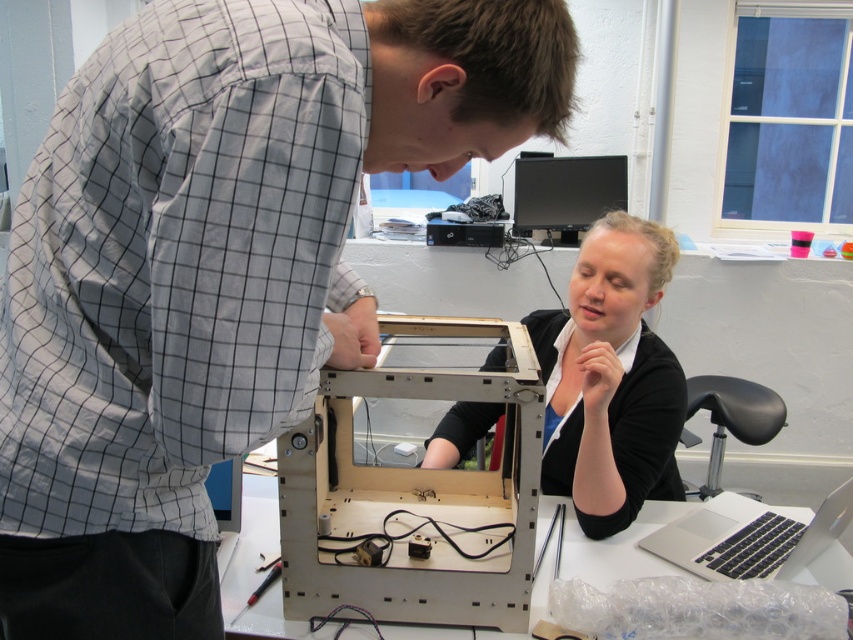
You are a technician who needs to place a new component on the largest available screen in the scene. Which object should you choose between the silver metallic laptop at lower right and the black glossy monitor at upper center?

The black glossy monitor at upper center is larger than the silver metallic laptop at lower right, so you should choose the black glossy monitor at upper center to place the new component.

You are an engineer who needs to transport both the metallic silver electronics at center and the silver metallic laptop at lower right in a box that can only accommodate items up to the size of the laptop. Can you fit both items into the box?

The metallic silver electronics at center is wider than the silver metallic laptop at lower right. Since the box can only fit items up to the laptop size, the electronics won not fit, so only the laptop can be placed in the box.